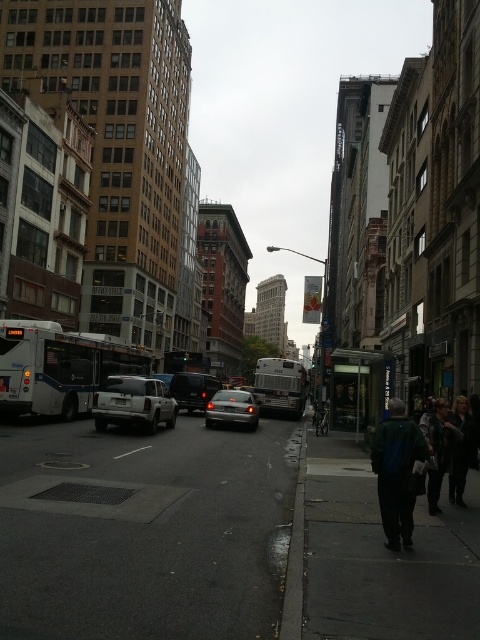
Does white matte bus at left have a lesser height compared to dark brown leather jacket at lower right?

No, white matte bus at left is not shorter than dark brown leather jacket at lower right.

Is white matte bus at left behind dark brown leather jacket at lower right?

Yes, white matte bus at left is further from the viewer.

Is point (93, 337) in front of point (468, 438)?

No, (93, 337) is further to viewer.

This screenshot has height=640, width=480. Find the location of `white matte bus at left`. white matte bus at left is located at coordinates (58, 368).

Looking at this image, who is shorter, dark asphalt sidewalk at lower right or silver metallic sedan at center?

→ With less height is dark asphalt sidewalk at lower right.

Is point (332, 486) closer to camera compared to point (233, 419)?

Yes, point (332, 486) is closer to viewer.

This screenshot has height=640, width=480. I want to click on dark asphalt sidewalk at lower right, so click(x=383, y=557).

Based on the photo, can you confirm if white matte bus at center is wider than dark brown leather jacket at lower right?

Correct, the width of white matte bus at center exceeds that of dark brown leather jacket at lower right.

Which is behind, point (274, 381) or point (466, 451)?

Positioned behind is point (274, 381).

This screenshot has width=480, height=640. In order to click on white matte bus at center in this screenshot , I will do `click(279, 385)`.